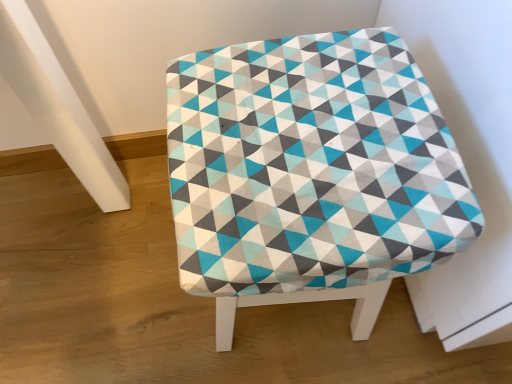
Find the location of a particular element. The height and width of the screenshot is (384, 512). vacant area situated to the left side of teal-patterned fabric stool at center is located at coordinates (131, 284).